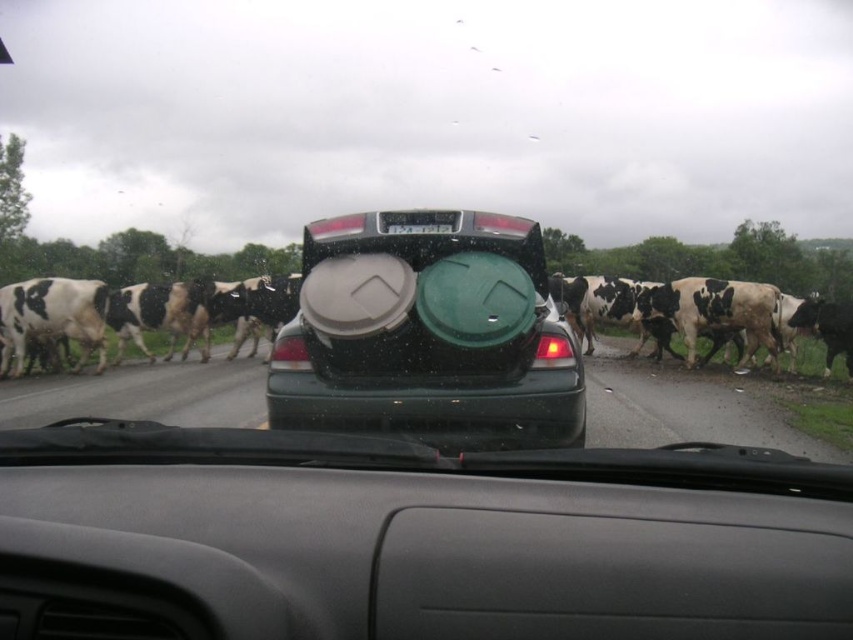
Question: Considering the relative positions of matte plastic trash can at center and black plastic license plate at center in the image provided, where is matte plastic trash can at center located with respect to black plastic license plate at center?

Choices:
 (A) left
 (B) right

Answer: (B)

Question: Among these points, which one is farthest from the camera?

Choices:
 (A) coord(386,227)
 (B) coord(296,362)

Answer: (A)

Question: Does matte plastic trash can at center have a smaller size compared to black plastic license plate at center?

Choices:
 (A) no
 (B) yes

Answer: (A)

Question: Can you confirm if matte plastic trash can at center is thinner than black plastic license plate at center?

Choices:
 (A) yes
 (B) no

Answer: (B)